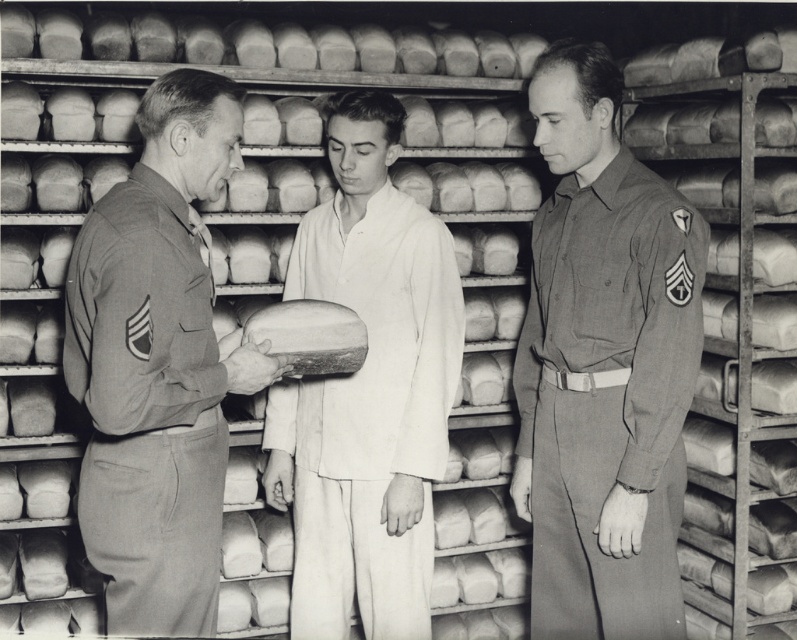
Can you confirm if matte khaki uniform at center is positioned above white cotton kimono at center?

Indeed, matte khaki uniform at center is positioned over white cotton kimono at center.

Does matte khaki uniform at center have a greater width compared to white cotton kimono at center?

In fact, matte khaki uniform at center might be narrower than white cotton kimono at center.

You are a GUI agent. You are given a task and a screenshot of the screen. Output one action in this format:
    pyautogui.click(x=<x>, y=<y>)
    Task: Click on the matte khaki uniform at center
    The image size is (797, 640).
    Given the screenshot: What is the action you would take?
    pyautogui.click(x=158, y=364)

Who is higher up, matte khaki uniform at center or gray cotton uniform at right?

matte khaki uniform at center is above.

Which is behind, point (222, 120) or point (658, 524)?

Positioned behind is point (658, 524).

Locate an element on the screen. The image size is (797, 640). matte khaki uniform at center is located at coordinates (158, 364).

Can you confirm if gray cotton uniform at right is positioned above white cotton kimono at center?

Yes.

Between gray cotton uniform at right and white cotton kimono at center, which one appears on the right side from the viewer's perspective?

From the viewer's perspective, gray cotton uniform at right appears more on the right side.

Between point (542, 250) and point (301, 285), which one is positioned behind?

The point (301, 285) is more distant.

Identify the location of gray cotton uniform at right. This screenshot has height=640, width=797. (607, 396).